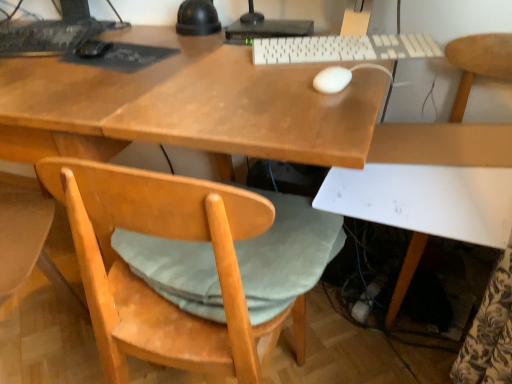
What are the coordinates of `vacant space in front of white plastic keyboard at center, the 2th computer keyboard in the back-to-front sequence` in the screenshot? It's located at (322, 92).